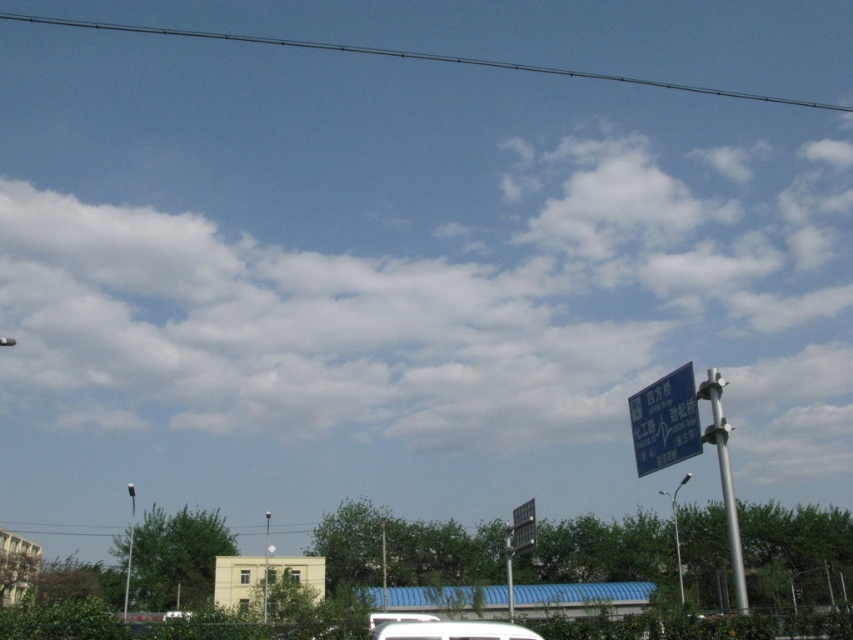
Who is shorter, blue metallic sign at upper right or black plastic street sign at center?

Standing shorter between the two is blue metallic sign at upper right.

In the scene shown: Can you confirm if blue metallic sign at upper right is positioned below black plastic street sign at center?

No.

The height and width of the screenshot is (640, 853). In order to click on blue metallic sign at upper right in this screenshot , I will do `click(665, 420)`.

Measure the distance between clear glass power line at upper center and camera.

clear glass power line at upper center and camera are 185.25 meters apart from each other.

Find the location of a particular element. This screenshot has height=640, width=853. clear glass power line at upper center is located at coordinates (415, 58).

Identify the location of clear glass power line at upper center. Image resolution: width=853 pixels, height=640 pixels. (415, 58).

Locate an element on the screen. blue metallic sign at upper right is located at coordinates (665, 420).

The width and height of the screenshot is (853, 640). What are the coordinates of `blue metallic sign at upper right` in the screenshot? It's located at (665, 420).